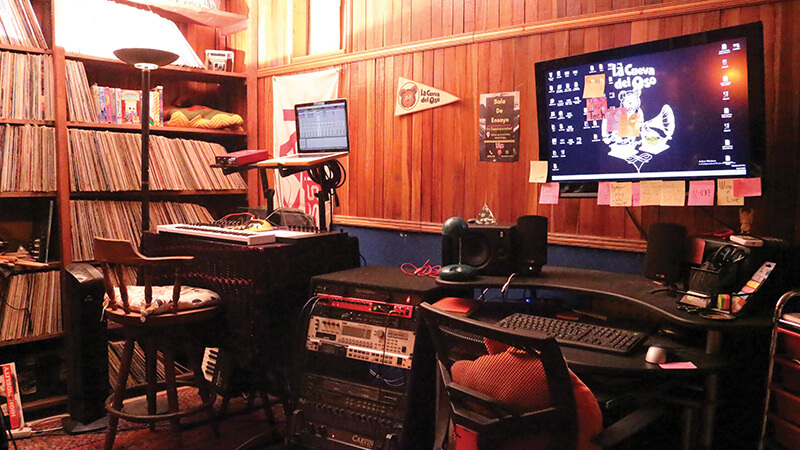
Find the location of `pennant`. pennant is located at coordinates (426, 96).